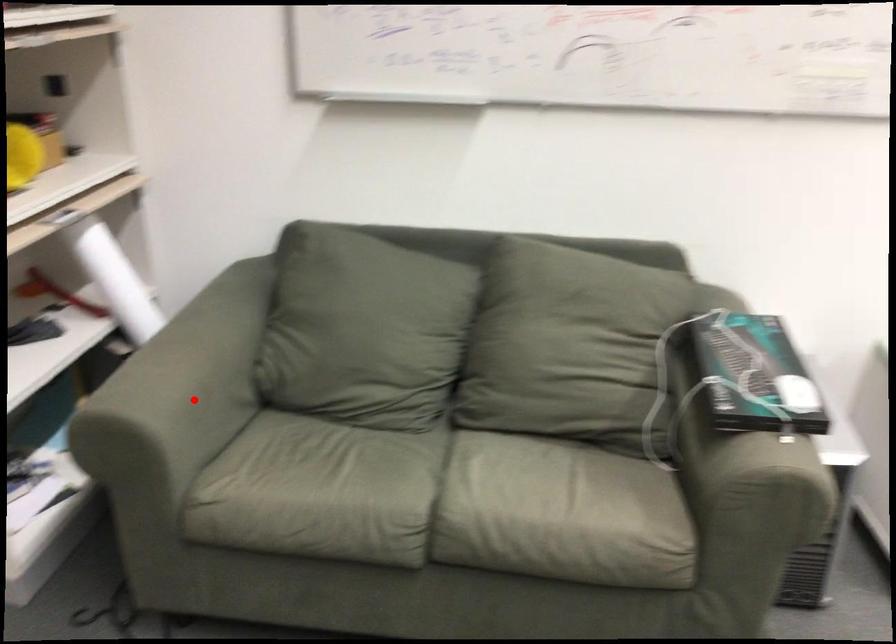
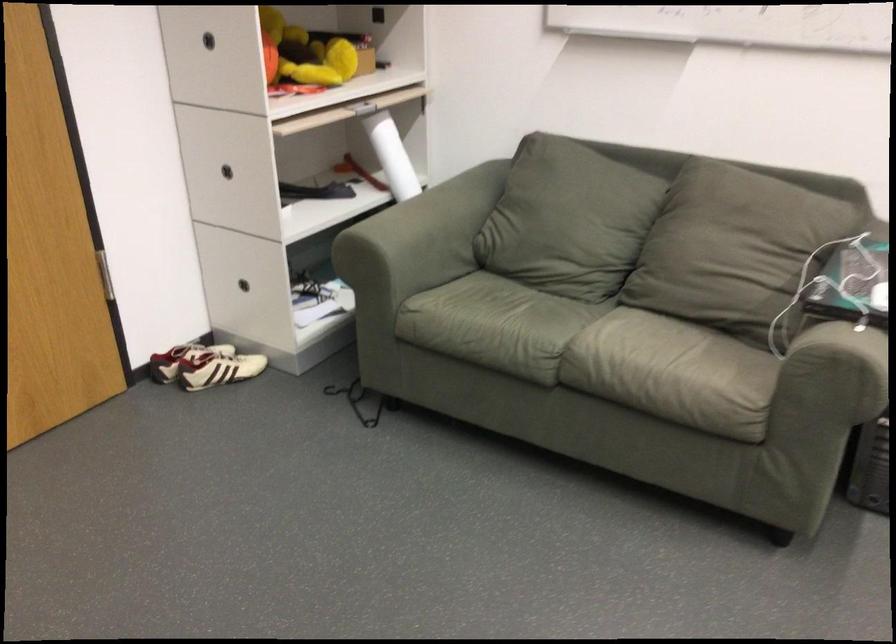
Question: I am providing you with two images of the same scene from different viewpoints. Image1 has a red point marked. In image2, the corresponding 3D location appears at what relative position? Reply with the corresponding letter.

Choices:
 (A) Closer
 (B) Farther

Answer: (B)